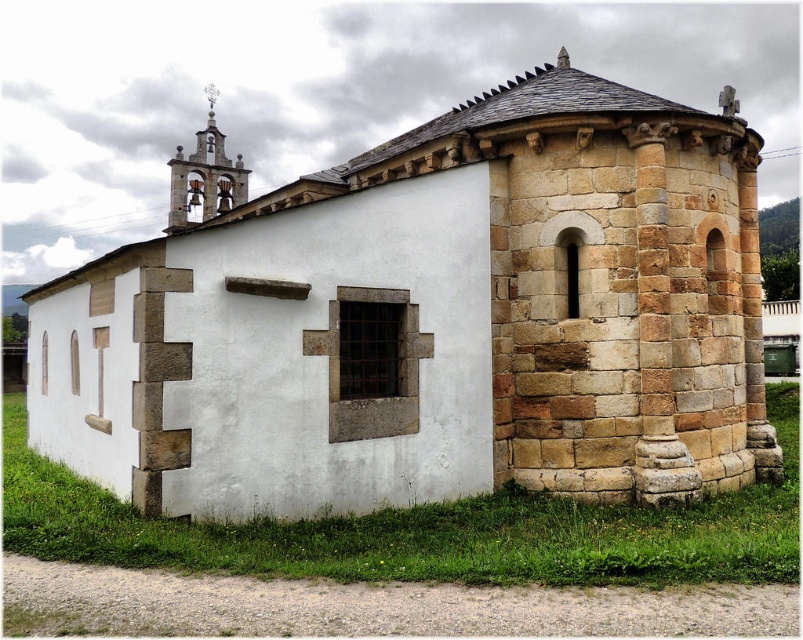
Question: Does stone church at center have a greater width compared to stone bell tower at upper left?

Choices:
 (A) yes
 (B) no

Answer: (A)

Question: Among these points, which one is farthest from the camera?

Choices:
 (A) (247, 304)
 (B) (168, 220)

Answer: (B)

Question: Is stone church at center bigger than stone bell tower at upper left?

Choices:
 (A) yes
 (B) no

Answer: (B)

Question: Can you confirm if stone church at center is positioned to the left of stone bell tower at upper left?

Choices:
 (A) no
 (B) yes

Answer: (A)

Question: Which point is closer to the camera taking this photo?

Choices:
 (A) (671, 150)
 (B) (194, 161)

Answer: (A)